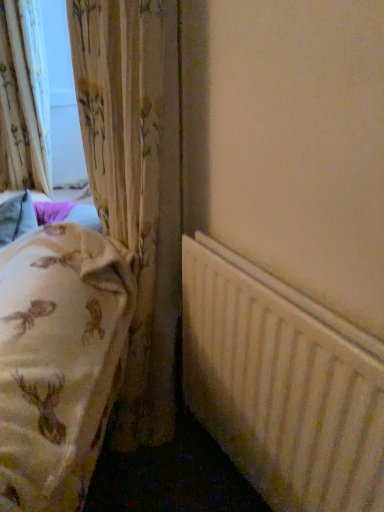
Question: Is floral fabric curtain at left, marked as the 1th curtain in a left-to-right arrangement, directly adjacent to white matte radiator at lower right?

Choices:
 (A) no
 (B) yes

Answer: (A)

Question: Does floral fabric curtain at left, which appears as the 2th curtain when viewed from the right, contain white matte radiator at lower right?

Choices:
 (A) no
 (B) yes

Answer: (A)

Question: Can you confirm if floral fabric curtain at left, positioned as the second curtain in front-to-back order, is taller than white matte radiator at lower right?

Choices:
 (A) no
 (B) yes

Answer: (B)

Question: From the image's perspective, is floral fabric curtain at left, marked as the 1th curtain in a left-to-right arrangement, located above white matte radiator at lower right?

Choices:
 (A) no
 (B) yes

Answer: (B)

Question: From the image's perspective, is floral fabric curtain at left, the first curtain from the back, below white matte radiator at lower right?

Choices:
 (A) yes
 (B) no

Answer: (B)

Question: Is floral fabric curtain at left, which appears as the 2th curtain when viewed from the right, looking in the opposite direction of white matte radiator at lower right?

Choices:
 (A) no
 (B) yes

Answer: (A)

Question: Would you consider floral fabric curtain at left, acting as the first curtain starting from the right, to be distant from white matte radiator at lower right?

Choices:
 (A) yes
 (B) no

Answer: (B)

Question: Would you say white matte radiator at lower right is part of floral fabric curtain at left, which is the 2th curtain from back to front,'s contents?

Choices:
 (A) yes
 (B) no

Answer: (B)

Question: Does floral fabric curtain at left, which is the 2th curtain from back to front, turn towards white matte radiator at lower right?

Choices:
 (A) yes
 (B) no

Answer: (B)

Question: Can you confirm if floral fabric curtain at left, acting as the first curtain starting from the right, is thinner than white matte radiator at lower right?

Choices:
 (A) no
 (B) yes

Answer: (A)

Question: Is floral fabric curtain at left, acting as the first curtain starting from the right, oriented away from white matte radiator at lower right?

Choices:
 (A) yes
 (B) no

Answer: (B)

Question: Are floral fabric curtain at left, the second curtain viewed from the left, and white matte radiator at lower right beside each other?

Choices:
 (A) no
 (B) yes

Answer: (A)

Question: Considering the relative sizes of white matte radiator at lower right and floral fabric curtain at left, the second curtain viewed from the left, in the image provided, is white matte radiator at lower right taller than floral fabric curtain at left, the second curtain viewed from the left,?

Choices:
 (A) no
 (B) yes

Answer: (A)